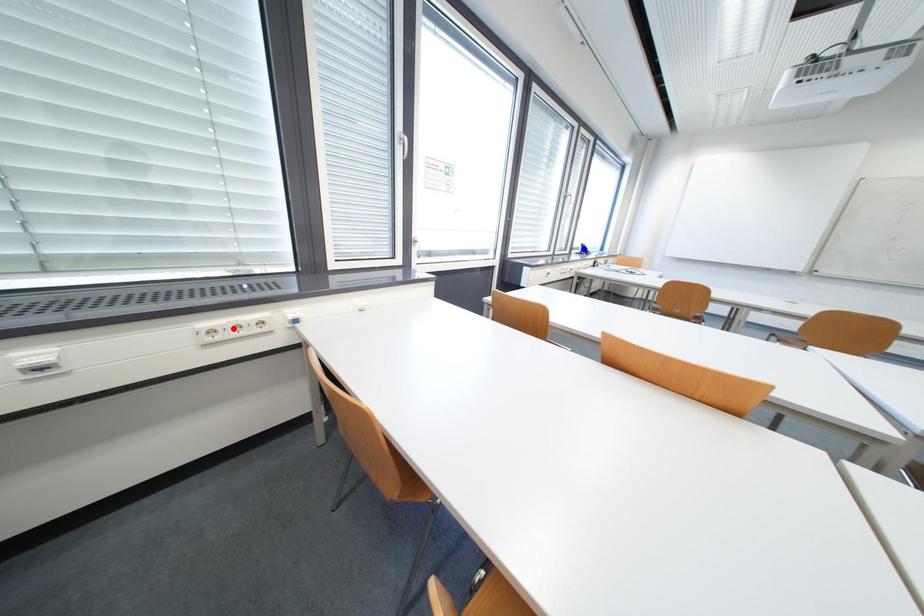
Question: In the image, two points are highlighted. Which point is nearer to the camera? Reply with the corresponding letter.

Choices:
 (A) blue point
 (B) red point

Answer: (B)